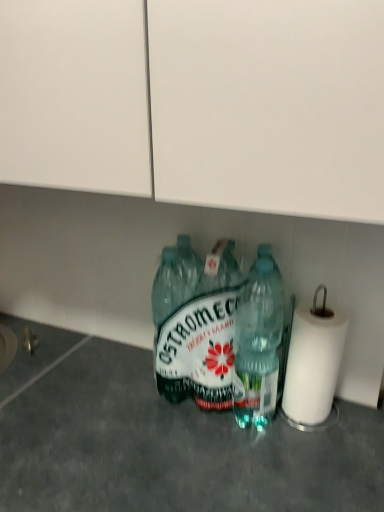
Where is `vacant space that is to the left of green plastic bottle at center, which appears as the first bottle when viewed from the left`? vacant space that is to the left of green plastic bottle at center, which appears as the first bottle when viewed from the left is located at coordinates (118, 392).